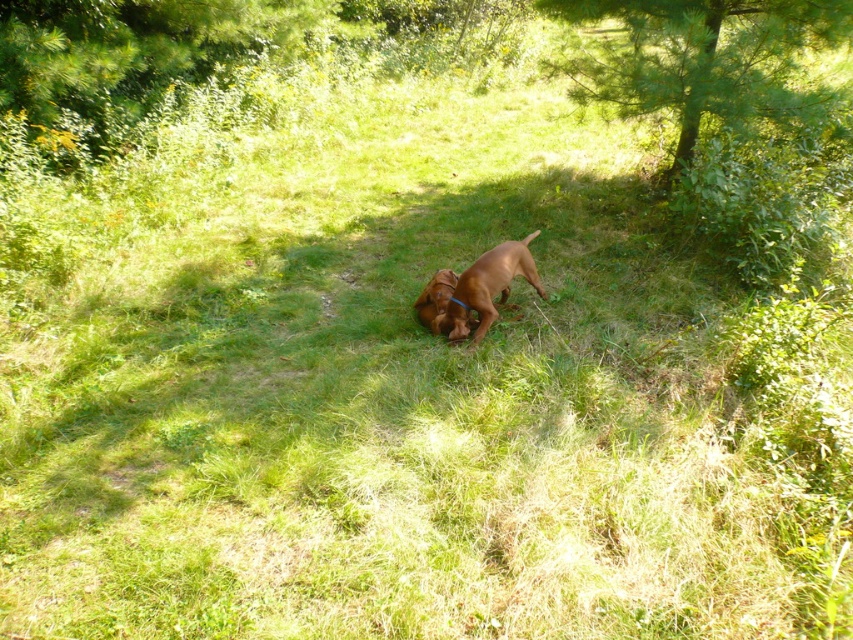
Question: Does brown glossy dog at center appear over brown furry dog at center?

Choices:
 (A) yes
 (B) no

Answer: (A)

Question: Which of the following is the closest to the observer?

Choices:
 (A) (425, 316)
 (B) (502, 275)
 (C) (647, 86)

Answer: (B)

Question: Estimate the real-world distances between objects in this image. Which object is farther from the brown glossy dog at center?

Choices:
 (A) green leafy tree at upper right
 (B) brown furry dog at center

Answer: (A)

Question: Which object appears closest to the camera in this image?

Choices:
 (A) green leafy tree at upper right
 (B) brown furry dog at center

Answer: (B)

Question: Can you confirm if brown glossy dog at center is wider than brown furry dog at center?

Choices:
 (A) yes
 (B) no

Answer: (A)

Question: Is green leafy tree at upper right thinner than brown glossy dog at center?

Choices:
 (A) no
 (B) yes

Answer: (A)